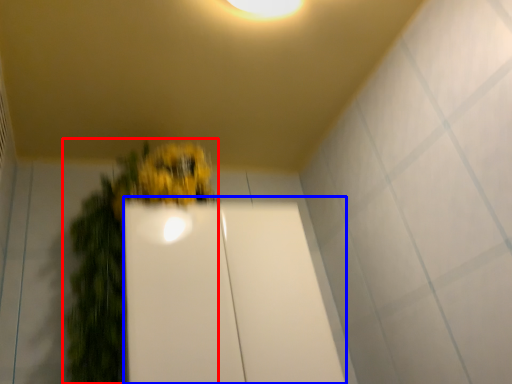
Question: Among these objects, which one is nearest to the camera, houseplant (highlighted by a red box) or glass door (highlighted by a blue box)?

Choices:
 (A) houseplant
 (B) glass door

Answer: (A)